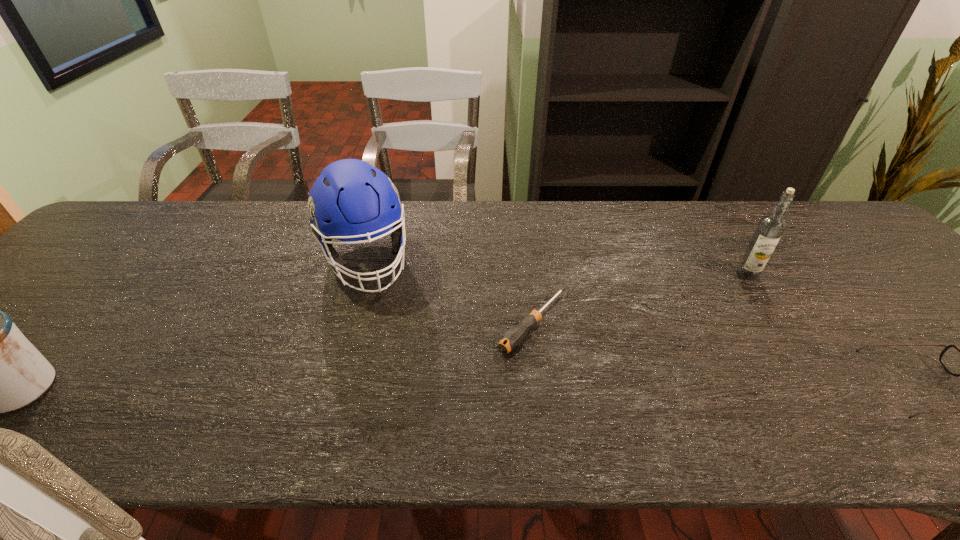
Find the location of a particular element. football helmet is located at coordinates (351, 200).

This screenshot has width=960, height=540. I want to click on the second object from right to left, so click(x=771, y=227).

Locate an element on the screen. the third object from right to left is located at coordinates (514, 336).

Image resolution: width=960 pixels, height=540 pixels. In order to click on screwdriver in this screenshot , I will do `click(514, 336)`.

Where is `vacant position located 0.080m on the front-facing side of the football helmet`? The height and width of the screenshot is (540, 960). vacant position located 0.080m on the front-facing side of the football helmet is located at coordinates (382, 319).

I want to click on free region located 0.110m on the front-facing side of the football helmet, so click(386, 328).

The height and width of the screenshot is (540, 960). Identify the location of vacant region located on the front-facing side of the football helmet. (388, 334).

Where is `vacant space situated on the label of the vodka`? vacant space situated on the label of the vodka is located at coordinates (675, 327).

The image size is (960, 540). What are the coordinates of `vacant position located on the label of the vodka` in the screenshot? It's located at (706, 305).

At what (x,y) coordinates should I click in order to perform the action: click on vacant region located on the label of the vodka. Please return your answer as a coordinate pair (x, y). Image resolution: width=960 pixels, height=540 pixels. Looking at the image, I should click on (726, 289).